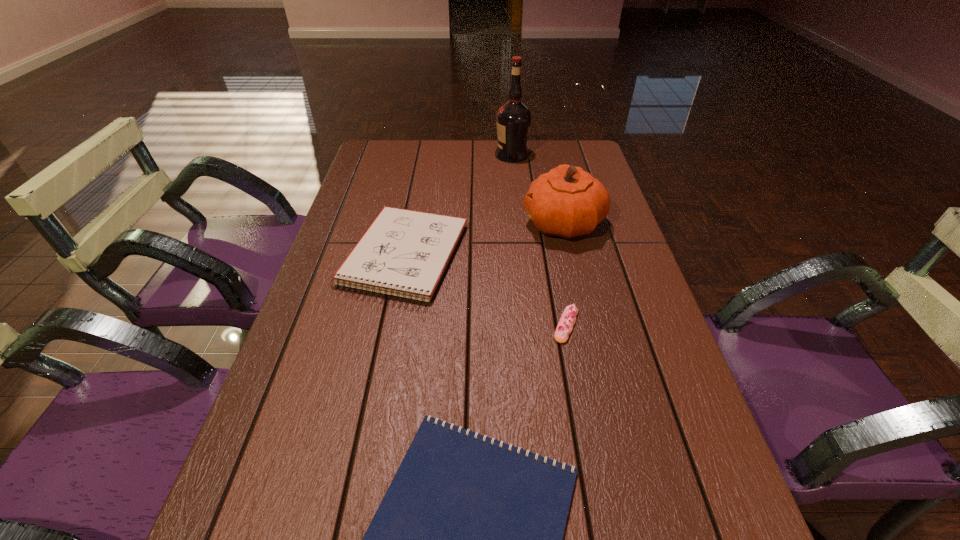
Identify the location of free space located on the front-facing side of the fourth shortest object. (429, 223).

The height and width of the screenshot is (540, 960). Identify the location of free space located on the front-facing side of the fourth shortest object. (416, 223).

Identify the location of vacant space positioned 0.290m on the front of the farther notepad. The width and height of the screenshot is (960, 540). tap(372, 430).

Locate an element on the screen. blank area located 0.320m on the front of the eclair is located at coordinates (600, 506).

You are a GUI agent. You are given a task and a screenshot of the screen. Output one action in this format:
    pyautogui.click(x=<x>, y=<y>)
    Task: Click on the object located at the far edge
    The width and height of the screenshot is (960, 540).
    Given the screenshot: What is the action you would take?
    pyautogui.click(x=513, y=119)

Locate an element on the screen. The width and height of the screenshot is (960, 540). object present at the left edge is located at coordinates 404,253.

At what (x,y) coordinates should I click in order to perform the action: click on object at the right edge. Please return your answer as a coordinate pair (x, y). Looking at the image, I should click on (566, 202).

The width and height of the screenshot is (960, 540). In the image, there is a desktop. What are the coordinates of `free region at the far edge` in the screenshot? It's located at (413, 161).

The width and height of the screenshot is (960, 540). I want to click on vacant region at the left edge, so click(x=283, y=530).

In the image, there is a desktop. Where is `vacant space at the right edge`? Image resolution: width=960 pixels, height=540 pixels. vacant space at the right edge is located at coordinates (580, 239).